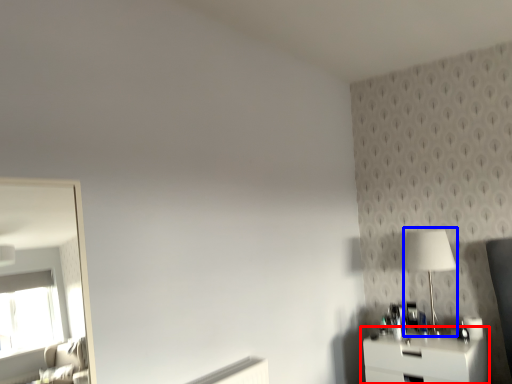
Question: Among these objects, which one is farthest to the camera, nightstand (highlighted by a red box) or table lamp (highlighted by a blue box)?

Choices:
 (A) nightstand
 (B) table lamp

Answer: (B)